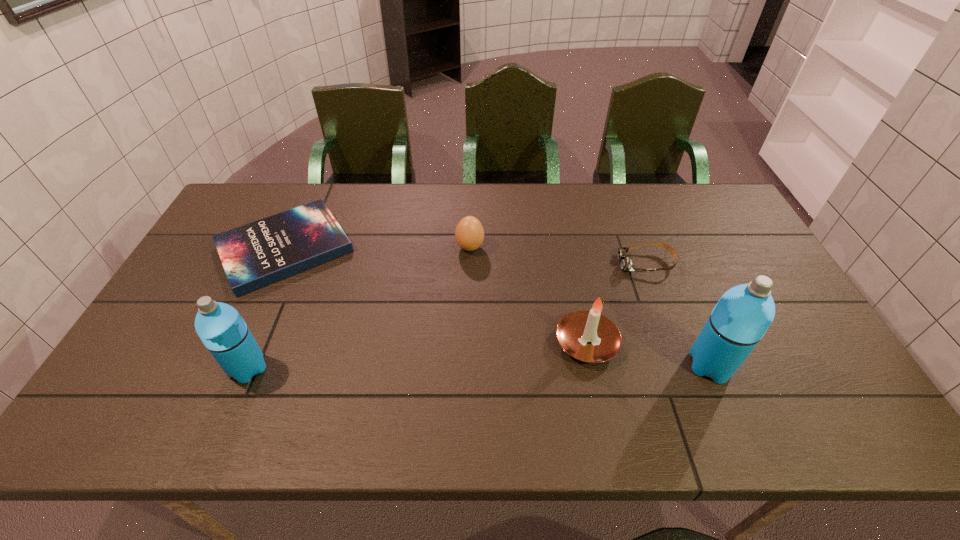
Locate an element on the screen. The height and width of the screenshot is (540, 960). object at the left edge is located at coordinates (254, 255).

Where is `object that is positioned at the far left corner`? The width and height of the screenshot is (960, 540). object that is positioned at the far left corner is located at coordinates (254, 255).

Locate an element on the screen. The height and width of the screenshot is (540, 960). vacant space at the far edge of the desktop is located at coordinates (305, 186).

Where is `free spot at the near edge of the desktop`? This screenshot has height=540, width=960. free spot at the near edge of the desktop is located at coordinates (737, 381).

At what (x,y) coordinates should I click in order to perform the action: click on free point at the left edge. Please return your answer as a coordinate pair (x, y). The width and height of the screenshot is (960, 540). Looking at the image, I should click on (215, 260).

The image size is (960, 540). In the image, there is a desktop. Find the location of `vacant space at the right edge`. vacant space at the right edge is located at coordinates (827, 361).

You are a GUI agent. You are given a task and a screenshot of the screen. Output one action in this format:
    pyautogui.click(x=<x>, y=<y>)
    Task: Click on the vacant area at the far left corner of the desktop
    This screenshot has width=960, height=540.
    Given the screenshot: What is the action you would take?
    pyautogui.click(x=226, y=220)

Where is `free point between the shortest object and the left thermos bottle`? This screenshot has height=540, width=960. free point between the shortest object and the left thermos bottle is located at coordinates (267, 308).

This screenshot has height=540, width=960. Find the location of `empty location between the goggles and the shorter thermos bottle`. empty location between the goggles and the shorter thermos bottle is located at coordinates (447, 316).

Locate an element on the screen. The height and width of the screenshot is (540, 960). free space that is in between the shortest object and the goggles is located at coordinates (466, 255).